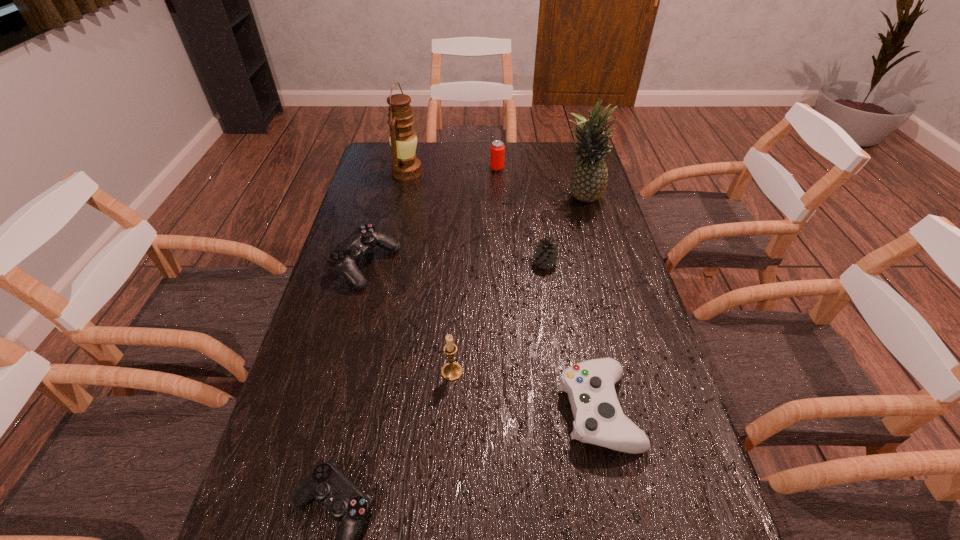
Where is `free point between the farthest control and the red beer can`? The width and height of the screenshot is (960, 540). free point between the farthest control and the red beer can is located at coordinates (432, 217).

Locate an element on the screen. Image resolution: width=960 pixels, height=540 pixels. free space between the green pineapple and the second farthest control is located at coordinates (590, 305).

Find the location of a particular element. This screenshot has height=540, width=960. free spot between the beer can and the farthest control is located at coordinates (432, 217).

You are a GUI agent. You are given a task and a screenshot of the screen. Output one action in this format:
    pyautogui.click(x=<x>, y=<y>)
    Task: Click on the vacant area that lies between the beer can and the sixth shortest object
    The image size is (960, 540).
    Given the screenshot: What is the action you would take?
    pyautogui.click(x=474, y=270)

Locate an element on the screen. blank region between the sixth shortest object and the farthest control is located at coordinates (409, 319).

Locate an element on the screen. object that is the nearest to the third tallest object is located at coordinates (598, 417).

What are the coordinates of `object that is the sixth nearest to the fourth object from left to right` in the screenshot? It's located at (405, 166).

Where is `control that is the second closest to the second farthest control`? This screenshot has height=540, width=960. control that is the second closest to the second farthest control is located at coordinates (343, 258).

Choose which control is the second nearest neighbor to the nearer black control. Please provide its 2D coordinates. Your answer should be formatted as a tuple, i.e. [(x, y)], where the tuple contains the x and y coordinates of a point satisfying the conditions above.

[(343, 258)]

Find the location of a particular element. The image size is (960, 540). free location that satisfies the following two spatial constraints: 1. on the back side of the oil lamp; 2. on the left side of the fifth object from left to right is located at coordinates pyautogui.click(x=408, y=168).